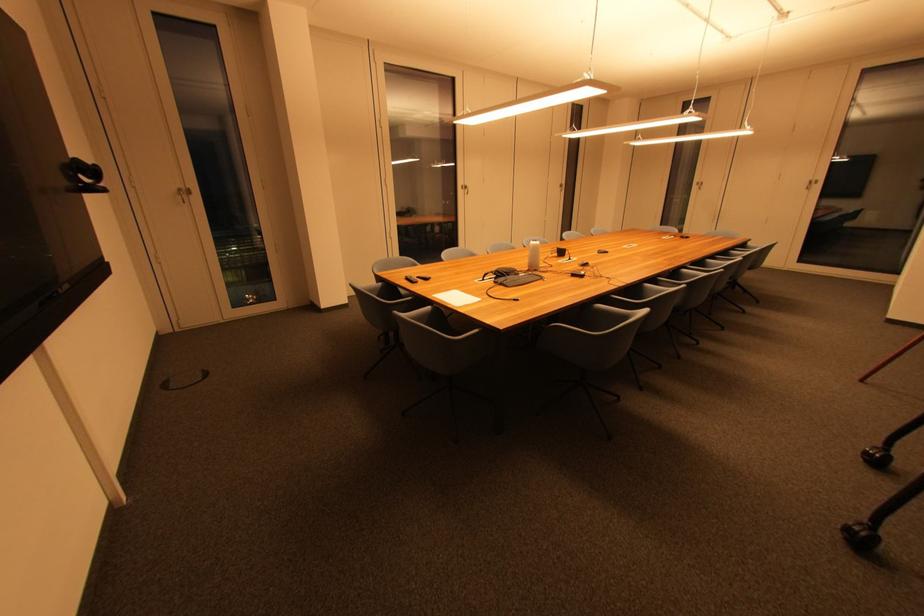
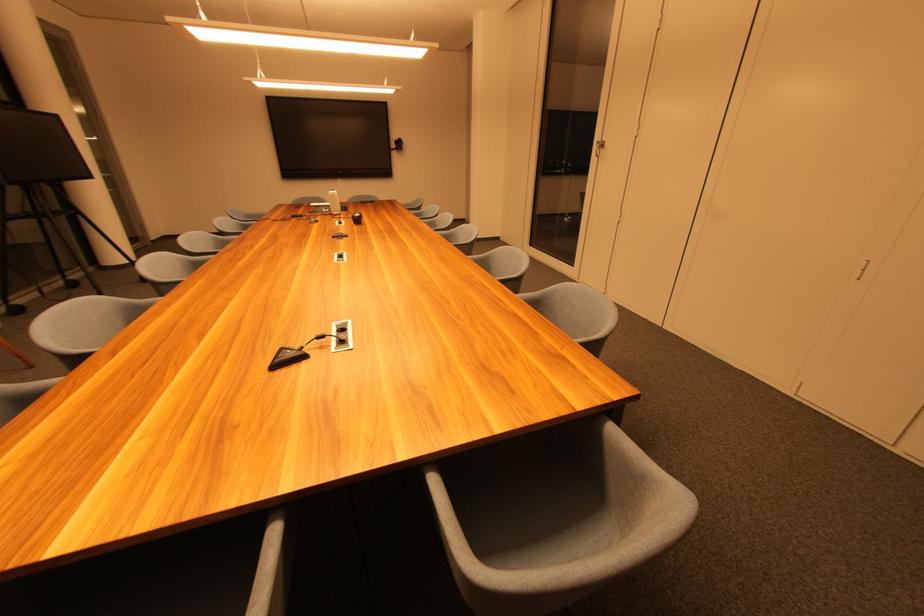
The point at (466, 185) is marked in the first image. Where is the corresponding point in the second image?

(602, 140)